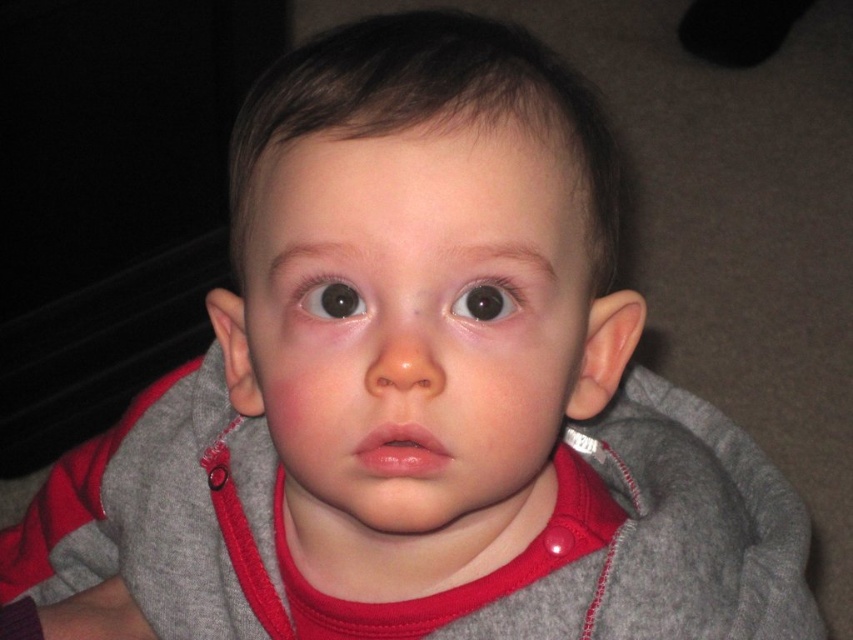
Between smooth skin face at center and black glossy eye at center, which one appears on the right side from the viewer's perspective?

black glossy eye at center is more to the right.

Who is higher up, smooth skin face at center or black glossy eye at center?

Positioned higher is black glossy eye at center.

Identify the location of smooth skin face at center. This screenshot has width=853, height=640. (415, 324).

The image size is (853, 640). Identify the location of smooth skin face at center. (415, 324).

Is black glossy eye at center thinner than brown glossy eye at center?

Correct, black glossy eye at center's width is less than brown glossy eye at center's.

Does black glossy eye at center have a greater width compared to brown glossy eye at center?

No.

What do you see at coordinates (485, 301) in the screenshot?
I see `black glossy eye at center` at bounding box center [485, 301].

Locate an element on the screen. black glossy eye at center is located at coordinates (485, 301).

Does smooth skin face at center have a greater width compared to brown glossy eye at center?

Yes, smooth skin face at center is wider than brown glossy eye at center.

Between point (392, 534) and point (305, 292), which one is positioned behind?

Point (392, 534)

Where is `smooth skin face at center`? The image size is (853, 640). smooth skin face at center is located at coordinates (415, 324).